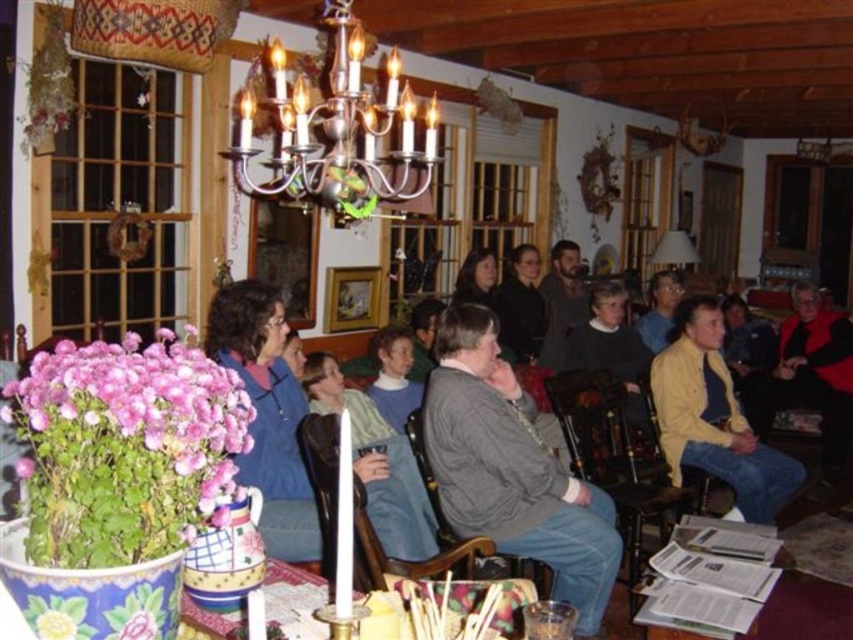
You are a guest at this gathering and want to place a small gift on the table. The gift requires placing it above the matte blue sweater at center but below the pink fabric flower at lower left. Is this possible?

The pink fabric flower at lower left is above the matte blue sweater at center, so there is space between them where the gift can be placed. Yes, it is possible to place the gift in that area.

You are standing in the rustic wooden cabin and want to place a small decoration between the two points marked as point (526,406) and point (38,602). Which point is closer to you so that you can easily reach it?

Point (526,406) is closer to you than point (38,602) because it is further to the viewer, making it easier to reach.